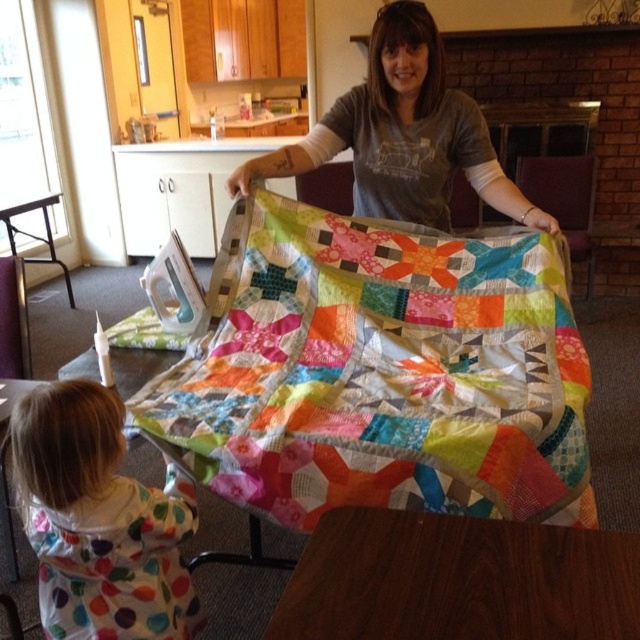
Does wooden table at center appear under white polka dot onesie at lower left?

Actually, wooden table at center is above white polka dot onesie at lower left.

Between point (317, 572) and point (93, 488), which one is positioned in front?

Positioned in front is point (317, 572).

You are a GUI agent. You are given a task and a screenshot of the screen. Output one action in this format:
    pyautogui.click(x=<x>, y=<y>)
    Task: Click on the wooden table at center
    Image resolution: width=640 pixels, height=640 pixels.
    Given the screenshot: What is the action you would take?
    pyautogui.click(x=458, y=580)

Between point (352, 413) and point (522, 547), which one is positioned behind?

Positioned behind is point (352, 413).

Where is `colorful patchwork quilt at center`? colorful patchwork quilt at center is located at coordinates (380, 371).

Which of these two, wooden table at center or matte gray shirt at center, stands shorter?

wooden table at center is shorter.

Does wooden table at center have a smaller size compared to matte gray shirt at center?

Yes.

Is point (500, 556) farther from camera compared to point (436, 97)?

No, it is in front of (436, 97).

What are the coordinates of `wooden table at center` in the screenshot? It's located at (458, 580).